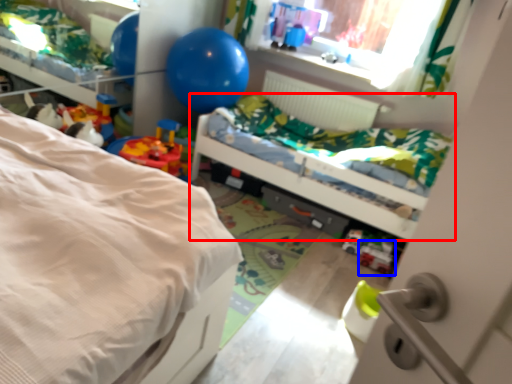
Question: Which object is closer to the camera taking this photo, bed (highlighted by a red box) or toy (highlighted by a blue box)?

Choices:
 (A) bed
 (B) toy

Answer: (A)